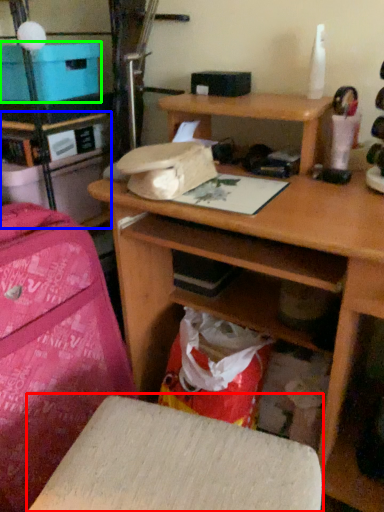
Question: Based on their relative distances, which object is farther from furniture (highlighted by a red box)? Choose from shelf (highlighted by a blue box) and cardboard box (highlighted by a green box).

Choices:
 (A) shelf
 (B) cardboard box

Answer: (B)